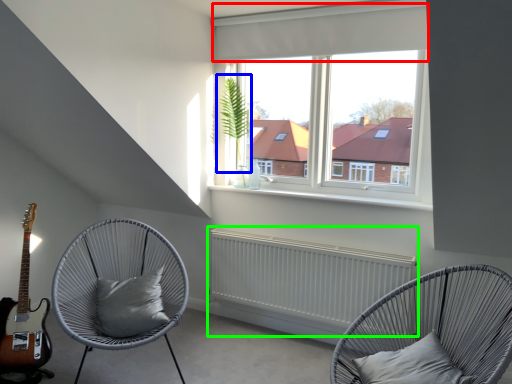
Question: Based on their relative distances, which object is nearer to curtain (highlighted by a red box)? Choose from plant (highlighted by a blue box) and radiator (highlighted by a green box).

Choices:
 (A) plant
 (B) radiator

Answer: (A)